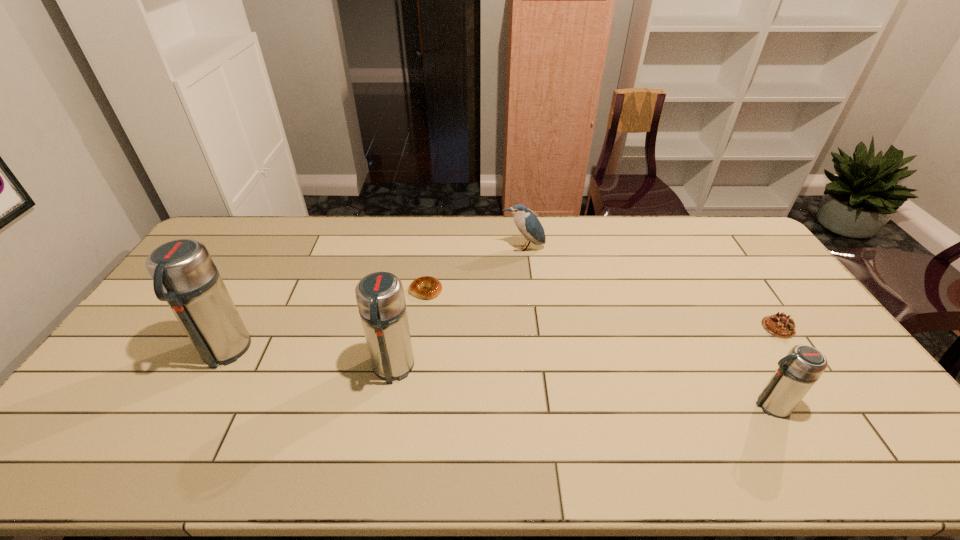
If we want them evenly spaced by inserting an extra thermos_bottle among them, please locate a free spot for this new thermos_bottle. Please provide its 2D coordinates. Your answer should be formatted as a tuple, i.e. [(x, y)], where the tuple contains the x and y coordinates of a point satisfying the conditions above.

[(575, 386)]